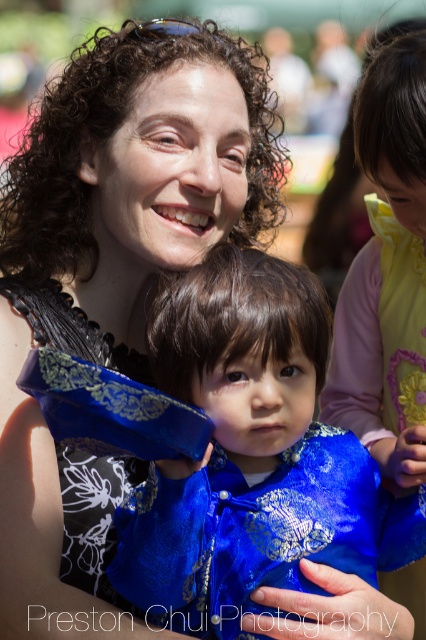
Is point (299, 480) farther from camera compared to point (377, 426)?

No, (299, 480) is in front of (377, 426).

The image size is (426, 640). I want to click on blue silk kimono at center, so click(x=252, y=456).

Between point (325, 486) and point (417, 246), which one is positioned in front?

Point (325, 486)

At what (x,y) coordinates should I click in order to perform the action: click on blue silk kimono at center. Please return your answer as a coordinate pair (x, y). Looking at the image, I should click on (252, 456).

Is matte black dress at upper left shorter than blue silk kimono at center?

No, matte black dress at upper left is not shorter than blue silk kimono at center.

Measure the distance between point (232,156) and camera.

Point (232,156) is 9.84 feet from camera.

Image resolution: width=426 pixels, height=640 pixels. I want to click on matte black dress at upper left, so click(x=112, y=275).

Who is taller, matte black dress at upper left or blue silk dress at upper right?

Standing taller between the two is matte black dress at upper left.

Who is positioned more to the right, matte black dress at upper left or blue silk dress at upper right?

Positioned to the right is blue silk dress at upper right.

Between point (259, 131) and point (414, 584), which one is positioned behind?

The point (259, 131) is more distant.

Locate an element on the screen. The image size is (426, 640). matte black dress at upper left is located at coordinates (112, 275).